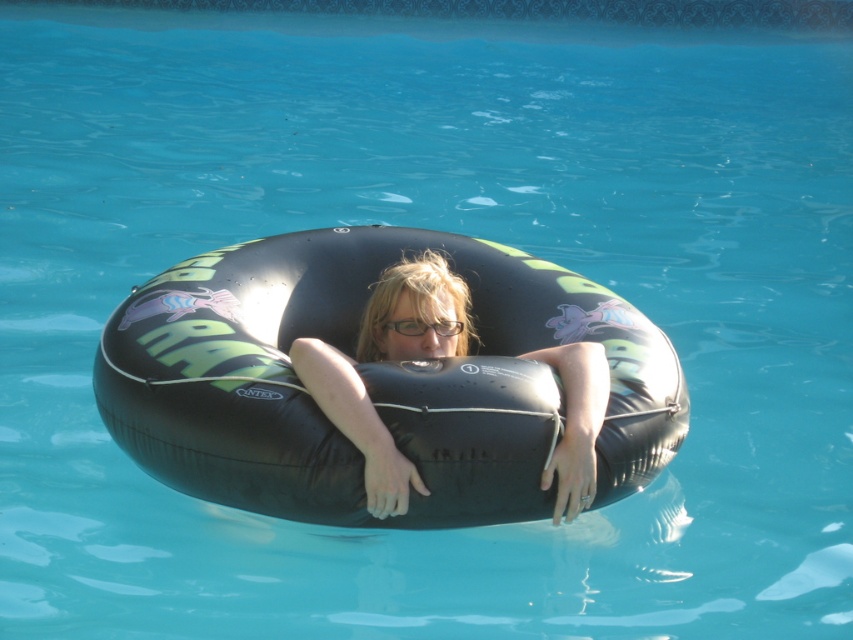
You are a lifeguard trying to determine if the clear plastic glasses at center can fit inside the black rubber tube at center without any part of the glasses sticking out. Based on their sizes, what would you conclude?

The black rubber tube at center might be wider than clear plastic glasses at center, so there is a possibility that the glasses could fit inside without sticking out, but the exact dimensions are uncertain.

You are a lifeguard standing at the edge of the pool. You see the point at coordinates (386, 358) in the pool. What object is located at that point?

The black rubber tube at center is located at point (386, 358).

You are a lifeguard standing at the edge of the pool and need to locate the black rubber tube at center. According to the coordinates given, where would you find it in the image?

The black rubber tube at center is located at the 2D coordinates point (386, 358) in the image.